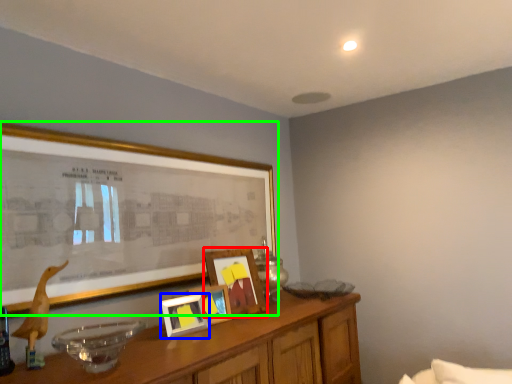
Question: Based on their relative distances, which object is nearer to picture frame (highlighted by a red box)? Choose from picture frame (highlighted by a blue box) and picture frame (highlighted by a green box).

Choices:
 (A) picture frame
 (B) picture frame

Answer: (A)